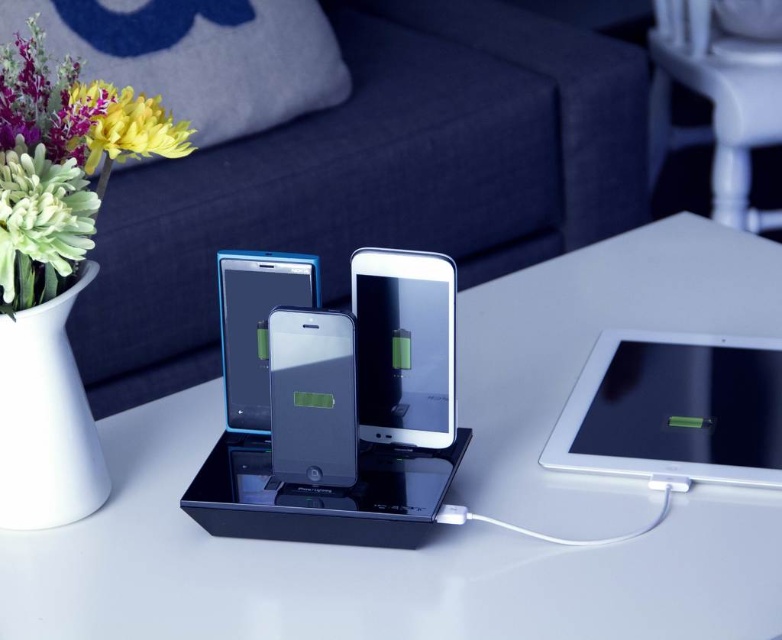
You are organizing a tech showcase and need to place a new device between the silver metallic tablet at right and the sleek glass ipod at center. Based on their current positions, where should you place the new device to maintain symmetry?

The silver metallic tablet at right is positioned on the right side of sleek glass ipod at center, so placing the new device between them would require positioning it to the left of the silver metallic tablet at right and to the right of the sleek glass ipod at center to maintain symmetry.

What object is located at the coordinates point [372,566] in the image?

The point [372,566] indicates the white glossy table at center.